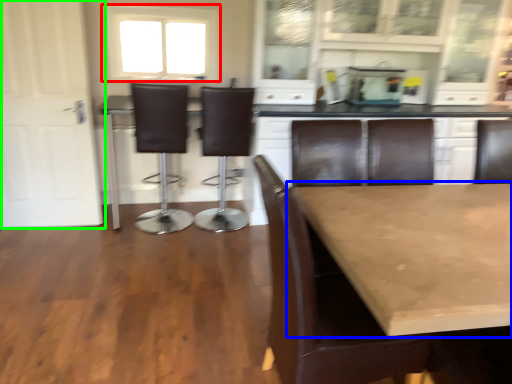
Question: Which object is the closest to the window (highlighted by a red box)? Choose among these: table (highlighted by a blue box) or door (highlighted by a green box).

Choices:
 (A) table
 (B) door

Answer: (B)